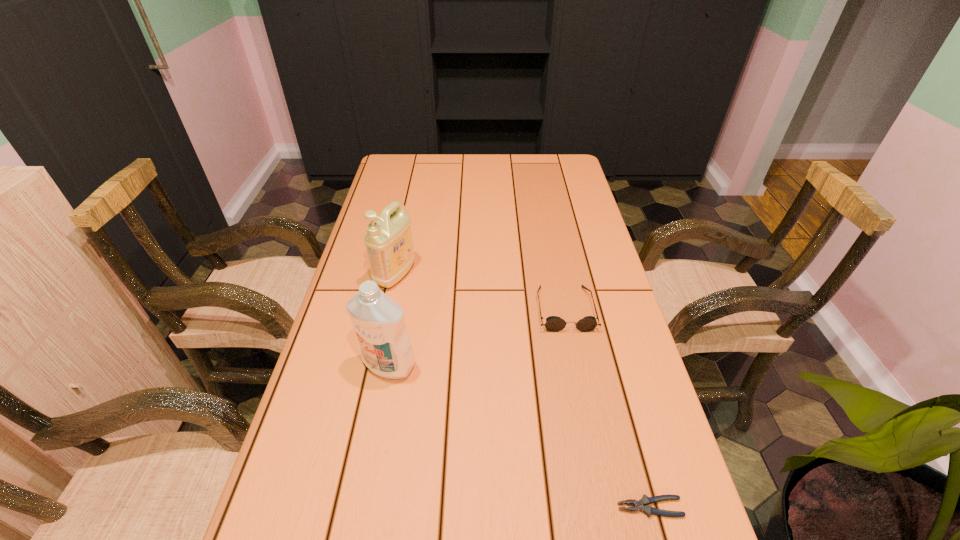
Where is `empty location between the pliers and the nearer detergent`? Image resolution: width=960 pixels, height=540 pixels. empty location between the pliers and the nearer detergent is located at coordinates (519, 436).

Where is `free point between the sunglasses and the nearer detergent`? The image size is (960, 540). free point between the sunglasses and the nearer detergent is located at coordinates (477, 337).

What are the coordinates of `free point between the shortest object and the farther detergent` in the screenshot? It's located at tap(522, 391).

Locate an element on the screen. The height and width of the screenshot is (540, 960). vacant area between the second shortest object and the nearest object is located at coordinates (608, 408).

Find the location of a particular element. The image size is (960, 540). free point between the nearer detergent and the shortest object is located at coordinates (519, 436).

The image size is (960, 540). I want to click on the closest object to the shortest object, so pos(553,323).

Identify which object is the closest to the nearer detergent. Please provide its 2D coordinates. Your answer should be formatted as a tuple, i.e. [(x, y)], where the tuple contains the x and y coordinates of a point satisfying the conditions above.

[(389, 244)]